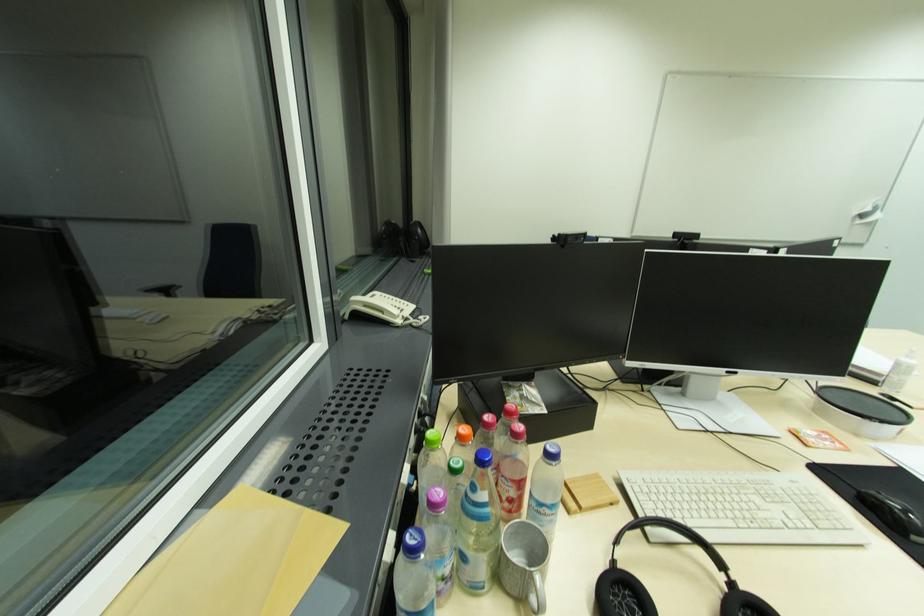
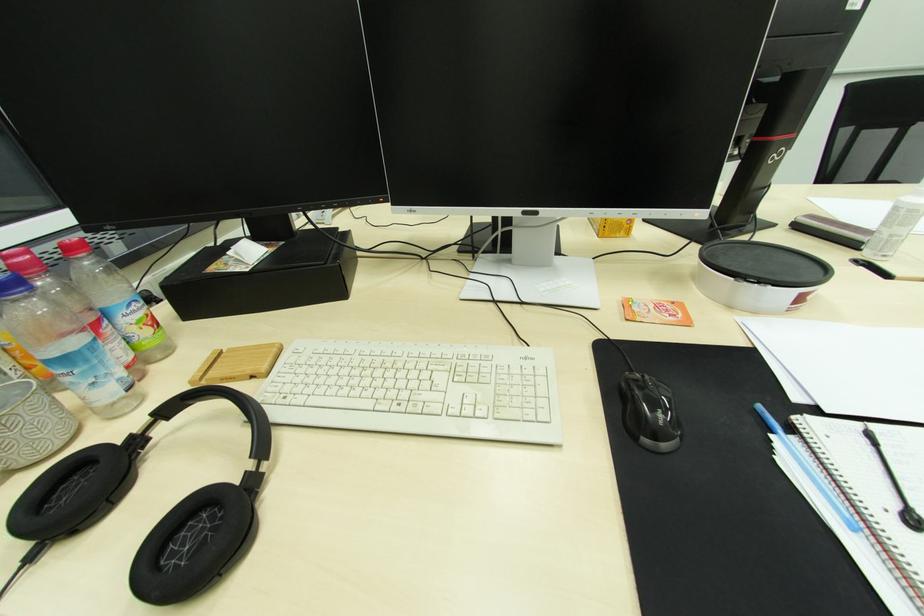
Question: Based on the continuous images, in which direction is the camera rotating? Reply with the corresponding letter.

Choices:
 (A) Left
 (B) Right
 (C) Up
 (D) Down

Answer: (D)